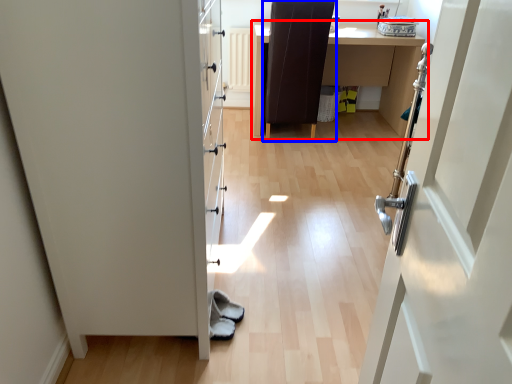
Question: Which of the following is the farthest to the observer, table (highlighted by a red box) or chair (highlighted by a blue box)?

Choices:
 (A) table
 (B) chair

Answer: (A)